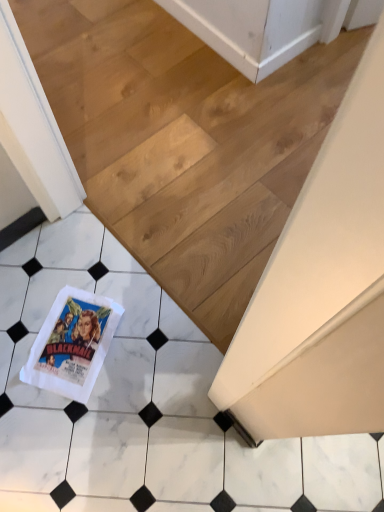
Question: Is white paper towel at lower left at the back of white marble tile at lower left?

Choices:
 (A) no
 (B) yes

Answer: (A)

Question: From the image's perspective, is white marble tile at lower left above white paper towel at lower left?

Choices:
 (A) yes
 (B) no

Answer: (A)

Question: Could you tell me if white marble tile at lower left is facing white paper towel at lower left?

Choices:
 (A) no
 (B) yes

Answer: (B)

Question: Is white paper towel at lower left located within white marble tile at lower left?

Choices:
 (A) no
 (B) yes

Answer: (A)

Question: Is the position of white marble tile at lower left less distant than that of white paper towel at lower left?

Choices:
 (A) yes
 (B) no

Answer: (B)

Question: Is white marble tile at lower left wider or thinner than white marble tile at lower left?

Choices:
 (A) wide
 (B) thin

Answer: (B)

Question: From a real-world perspective, is white marble tile at lower left above or below white marble tile at lower left?

Choices:
 (A) below
 (B) above

Answer: (A)

Question: From their relative heights in the image, would you say white marble tile at lower left is taller or shorter than white marble tile at lower left?

Choices:
 (A) short
 (B) tall

Answer: (B)

Question: In the image, is white marble tile at lower left positioned in front of or behind white marble tile at lower left?

Choices:
 (A) behind
 (B) front

Answer: (A)

Question: Looking at the image, does white marble tile at lower left seem bigger or smaller compared to white paper towel at lower left?

Choices:
 (A) small
 (B) big

Answer: (B)

Question: From the image's perspective, is white marble tile at lower left above or below white paper towel at lower left?

Choices:
 (A) above
 (B) below

Answer: (A)

Question: Is white marble tile at lower left situated inside white paper towel at lower left or outside?

Choices:
 (A) inside
 (B) outside

Answer: (B)

Question: Looking at their shapes, would you say white marble tile at lower left is wider or thinner than white paper towel at lower left?

Choices:
 (A) thin
 (B) wide

Answer: (B)

Question: From a real-world perspective, is white marble tile at lower left above or below white marble tile at lower left?

Choices:
 (A) below
 (B) above

Answer: (B)

Question: From the image's perspective, relative to white marble tile at lower left, is white marble tile at lower left above or below?

Choices:
 (A) below
 (B) above

Answer: (A)